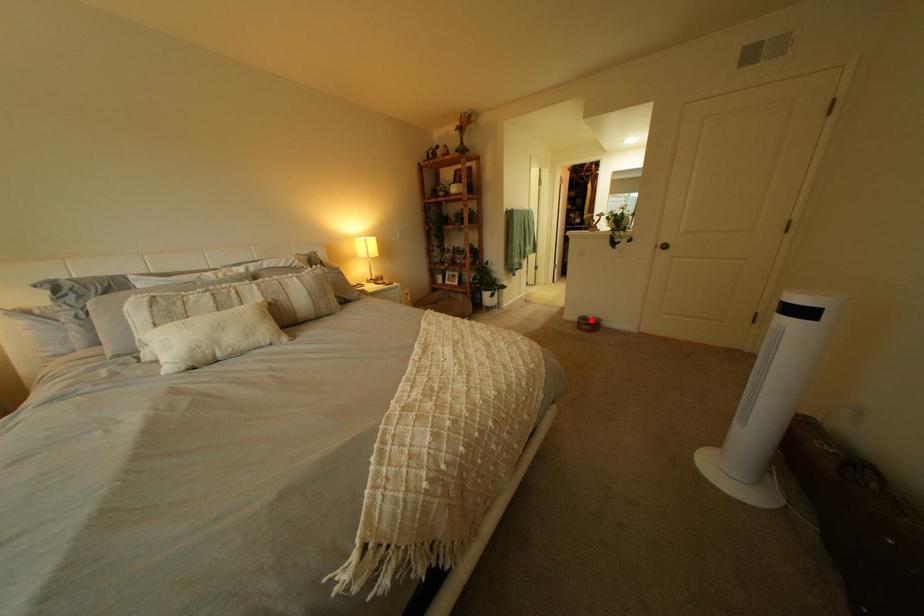
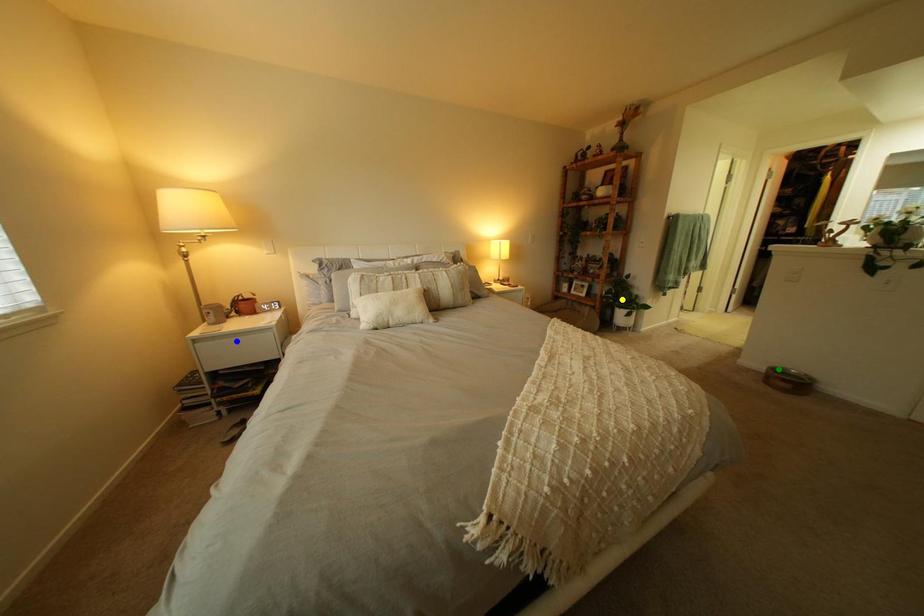
Question: I am providing you with two images of the same scene from different viewpoints. A red point is marked on the first image. You are given multiple points on the second image. Which point in image 2 represents the same 3d spot as the red point in image 1?

Choices:
 (A) green point
 (B) yellow point
 (C) blue point

Answer: (A)